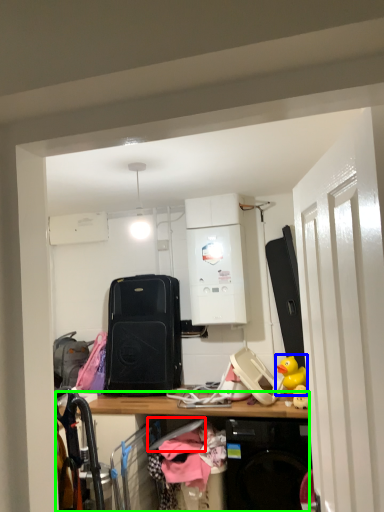
Question: Which object is positioned closest to hanger (highlighted by a red box)? Select from toy (highlighted by a blue box) and desk (highlighted by a green box).

Choices:
 (A) toy
 (B) desk

Answer: (B)